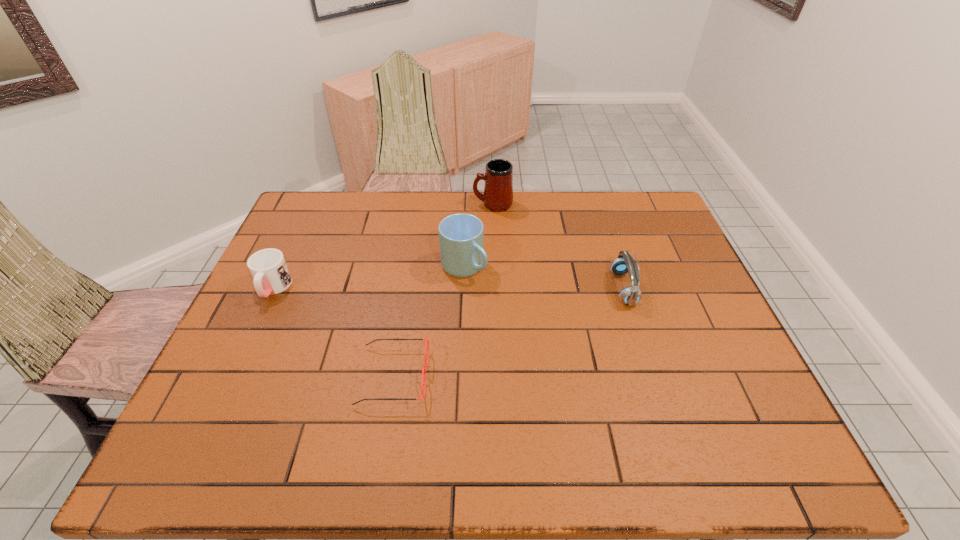
The image size is (960, 540). In the image, there is a desktop. Find the location of `vacant space at the right edge`. vacant space at the right edge is located at coordinates point(729,372).

I want to click on free space between the leftmost object and the third shortest object, so click(x=448, y=288).

You are a GUI agent. You are given a task and a screenshot of the screen. Output one action in this format:
    pyautogui.click(x=<x>, y=<y>)
    Task: Click on the unoccupied position between the third tallest object and the farthest mug
    The width and height of the screenshot is (960, 540).
    Given the screenshot: What is the action you would take?
    pyautogui.click(x=558, y=246)

Where is `empty space between the fourth object from right to left and the shortest mug`? The width and height of the screenshot is (960, 540). empty space between the fourth object from right to left and the shortest mug is located at coordinates (333, 332).

Locate an element on the screen. vacant area that lies between the third tallest object and the leftmost object is located at coordinates (448, 288).

Find the location of a particular element. Image resolution: width=960 pixels, height=540 pixels. free space between the farthest mug and the leftmost object is located at coordinates (383, 246).

Where is `free space between the shortest mug and the second object from left to right`? free space between the shortest mug and the second object from left to right is located at coordinates (333, 332).

Find the location of `vacant region between the spectacles and the third shortest object`. vacant region between the spectacles and the third shortest object is located at coordinates (508, 332).

Select which object appears as the fourth closest to the fourth tallest object. Please provide its 2D coordinates. Your answer should be formatted as a tuple, i.e. [(x, y)], where the tuple contains the x and y coordinates of a point satisfying the conditions above.

[(624, 263)]

Identify which object is the fourth closest to the leftmost mug. Please provide its 2D coordinates. Your answer should be formatted as a tuple, i.e. [(x, y)], where the tuple contains the x and y coordinates of a point satisfying the conditions above.

[(624, 263)]